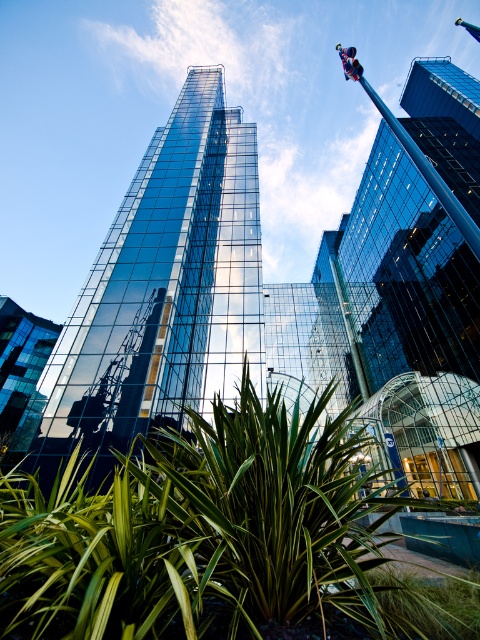
Question: Does glossy glass tower at center have a smaller size compared to glassy steel tower at center?

Choices:
 (A) yes
 (B) no

Answer: (A)

Question: Estimate the real-world distances between objects in this image. Which object is farther from the green leafy plant at center?

Choices:
 (A) glassy steel tower at center
 (B) glossy glass tower at center

Answer: (A)

Question: Considering the real-world distances, which object is farthest from the glassy steel tower at center?

Choices:
 (A) glossy glass tower at center
 (B) shiny glass building at lower left
 (C) green leafy plant at center

Answer: (B)

Question: From the image, what is the correct spatial relationship of green leafy plant at center in relation to glassy steel tower at center?

Choices:
 (A) right
 (B) left

Answer: (B)

Question: Does glassy steel tower at center come in front of shiny glass building at lower left?

Choices:
 (A) yes
 (B) no

Answer: (A)

Question: Based on their relative distances, which object is farther from the glossy glass tower at center?

Choices:
 (A) shiny glass building at lower left
 (B) green leafy plant at center
 (C) glassy steel tower at center

Answer: (A)